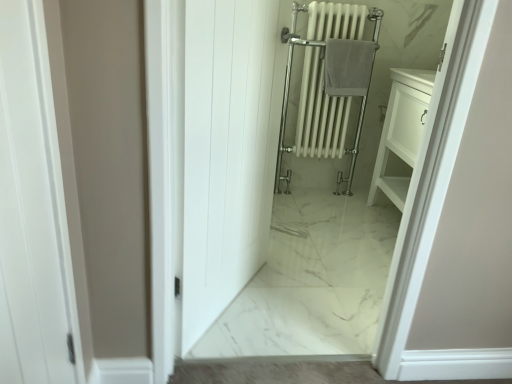
Question: From the image's perspective, is white wood door at center located above white glossy radiator at center?

Choices:
 (A) yes
 (B) no

Answer: (B)

Question: From a real-world perspective, is white wood door at center beneath white glossy radiator at center?

Choices:
 (A) no
 (B) yes

Answer: (B)

Question: Does white wood door at center come in front of white glossy radiator at center?

Choices:
 (A) no
 (B) yes

Answer: (B)

Question: Can you confirm if white wood door at center is wider than white glossy radiator at center?

Choices:
 (A) yes
 (B) no

Answer: (B)

Question: Is white wood door at center thinner than white glossy radiator at center?

Choices:
 (A) no
 (B) yes

Answer: (B)

Question: Considering the relative sizes of white wood door at center and white glossy radiator at center in the image provided, is white wood door at center bigger than white glossy radiator at center?

Choices:
 (A) yes
 (B) no

Answer: (B)

Question: Is gray cotton towel at center wider than white glossy radiator at center?

Choices:
 (A) yes
 (B) no

Answer: (B)

Question: Is gray cotton towel at center bigger than white glossy radiator at center?

Choices:
 (A) no
 (B) yes

Answer: (A)

Question: Is gray cotton towel at center smaller than white glossy radiator at center?

Choices:
 (A) yes
 (B) no

Answer: (A)

Question: Does gray cotton towel at center have a lesser height compared to white glossy radiator at center?

Choices:
 (A) yes
 (B) no

Answer: (A)

Question: Does gray cotton towel at center appear on the left side of white glossy radiator at center?

Choices:
 (A) yes
 (B) no

Answer: (B)

Question: Is gray cotton towel at center thinner than white glossy radiator at center?

Choices:
 (A) no
 (B) yes

Answer: (B)

Question: Does white glossy radiator at center contain gray cotton towel at center?

Choices:
 (A) no
 (B) yes

Answer: (B)